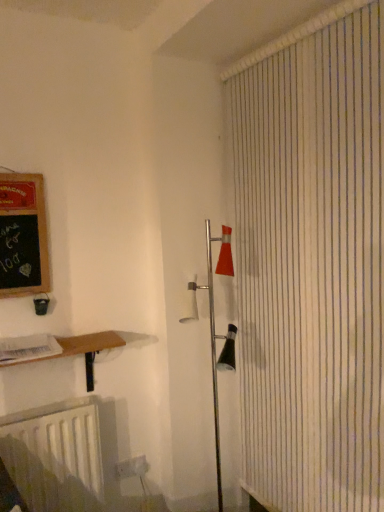
Question: From a real-world perspective, does white matte radiator at lower left sit lower than black chalkboard at left?

Choices:
 (A) yes
 (B) no

Answer: (A)

Question: Does white matte radiator at lower left turn towards black chalkboard at left?

Choices:
 (A) no
 (B) yes

Answer: (A)

Question: Is white matte radiator at lower left to the left of black chalkboard at left from the viewer's perspective?

Choices:
 (A) yes
 (B) no

Answer: (B)

Question: Is white matte radiator at lower left shorter than black chalkboard at left?

Choices:
 (A) yes
 (B) no

Answer: (B)

Question: From the image's perspective, does white matte radiator at lower left appear lower than black chalkboard at left?

Choices:
 (A) no
 (B) yes

Answer: (B)

Question: Is white matte radiator at lower left thinner than black chalkboard at left?

Choices:
 (A) no
 (B) yes

Answer: (A)

Question: Does wooden at lower left appear on the left side of black chalkboard at left?

Choices:
 (A) no
 (B) yes

Answer: (A)

Question: From a real-world perspective, is wooden at lower left below black chalkboard at left?

Choices:
 (A) yes
 (B) no

Answer: (A)

Question: Is wooden at lower left facing towards black chalkboard at left?

Choices:
 (A) no
 (B) yes

Answer: (A)

Question: Considering the relative sizes of wooden at lower left and black chalkboard at left in the image provided, is wooden at lower left wider than black chalkboard at left?

Choices:
 (A) no
 (B) yes

Answer: (B)

Question: Is wooden at lower left positioned with its back to black chalkboard at left?

Choices:
 (A) no
 (B) yes

Answer: (A)

Question: Is wooden at lower left surrounding black chalkboard at left?

Choices:
 (A) no
 (B) yes

Answer: (A)

Question: Considering the relative sizes of white striped shower curtain at right and black chalkboard at left in the image provided, is white striped shower curtain at right shorter than black chalkboard at left?

Choices:
 (A) yes
 (B) no

Answer: (B)